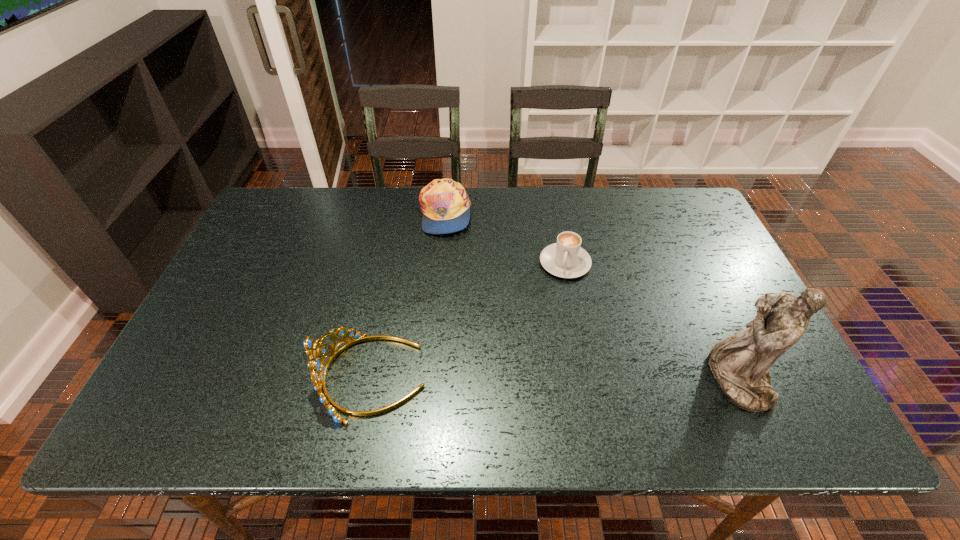
You are a GUI agent. You are given a task and a screenshot of the screen. Output one action in this format:
    pyautogui.click(x=<x>, y=<y>)
    Task: Click on the vacant area between the rightmost object and the cap
    
    Given the screenshot: What is the action you would take?
    pyautogui.click(x=591, y=296)

This screenshot has width=960, height=540. I want to click on free point between the cap and the second tallest object, so click(409, 296).

Locate an element on the screen. The image size is (960, 540). free space between the third nearest object and the cap is located at coordinates (505, 239).

Locate an element on the screen. The width and height of the screenshot is (960, 540). blank region between the farthest object and the second tallest object is located at coordinates (409, 296).

The width and height of the screenshot is (960, 540). Find the location of `free space between the cappuccino and the rightmost object`. free space between the cappuccino and the rightmost object is located at coordinates (651, 321).

At what (x,y) coordinates should I click in order to perform the action: click on unoccupied position between the cap and the tallest object. Please return your answer as a coordinate pair (x, y). This screenshot has width=960, height=540. Looking at the image, I should click on (591, 296).

I want to click on free area in between the rightmost object and the cap, so click(591, 296).

The image size is (960, 540). In order to click on blank region between the third object from left to right and the tallest object in this screenshot , I will do `click(651, 321)`.

Identify which object is the second closest to the cap. Please provide its 2D coordinates. Your answer should be formatted as a tuple, i.e. [(x, y)], where the tuple contains the x and y coordinates of a point satisfying the conditions above.

[(318, 370)]

Find the location of a particular element. object that is the third closest to the third shortest object is located at coordinates (740, 363).